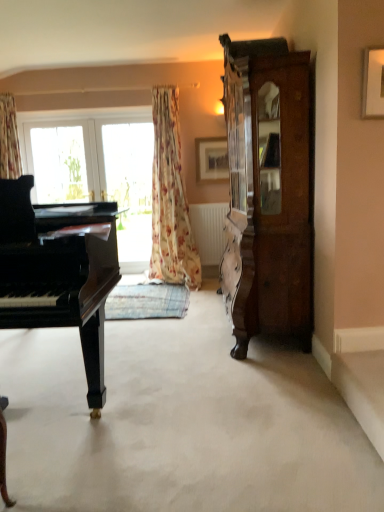
Question: Considering the positions of clear glass window at center and dark brown wood cabinet at right in the image, is clear glass window at center bigger or smaller than dark brown wood cabinet at right?

Choices:
 (A) small
 (B) big

Answer: (A)

Question: Visually, is clear glass window at center positioned to the left or to the right of dark brown wood cabinet at right?

Choices:
 (A) right
 (B) left

Answer: (B)

Question: Which object is positioned closest to the black polished piano at left?

Choices:
 (A) wooden picture frame at upper right, arranged as the second picture frame when viewed from the back
 (B) wooden picture frame at upper center, which is the 1th picture frame in left-to-right order
 (C) white matte radiator at center
 (D) floral fabric curtain at center
 (E) dark brown wood cabinet at right

Answer: (D)

Question: Estimate the real-world distances between objects in this image. Which object is farther from the clear glass window at center?

Choices:
 (A) wooden picture frame at upper center, which is the 1th picture frame in left-to-right order
 (B) black polished piano at left
 (C) white matte radiator at center
 (D) black polished piano at left
 (E) wooden picture frame at upper right, arranged as the second picture frame when viewed from the left

Answer: (E)